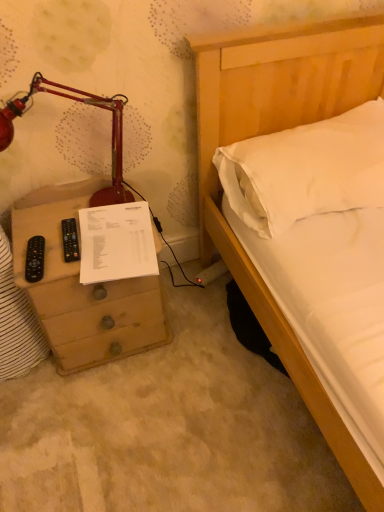
Find the location of a particular element. Image resolution: width=384 pixels, height=512 pixels. vacant area in front of wooden chest of drawers at left is located at coordinates (105, 419).